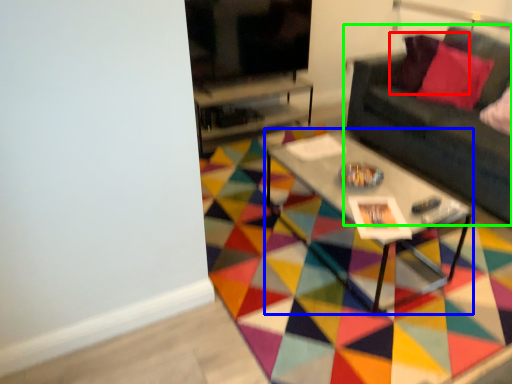
Question: Which is farther away from pillow (highlighted by a red box)? coffee table (highlighted by a blue box) or studio couch (highlighted by a green box)?

Choices:
 (A) coffee table
 (B) studio couch

Answer: (A)